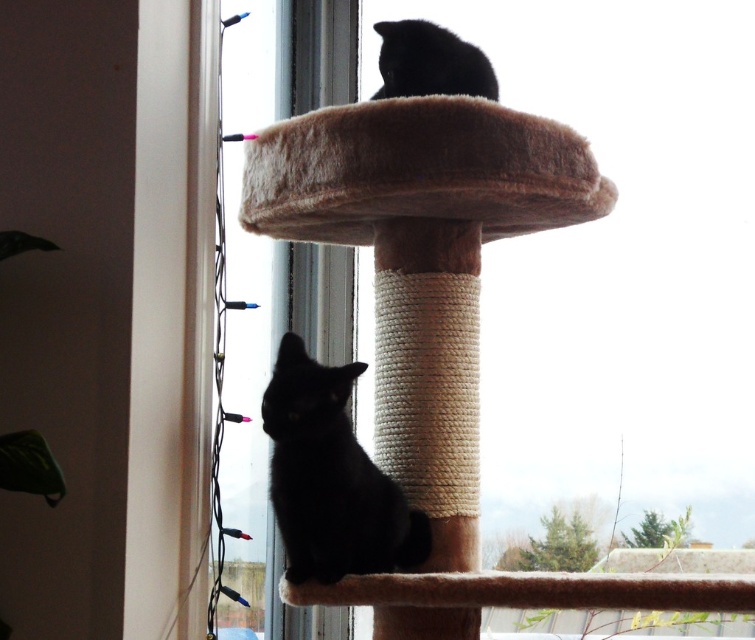
Question: Is black matte cat at lower center above black fur cat at upper center?

Choices:
 (A) no
 (B) yes

Answer: (A)

Question: Is black matte cat at lower center further to camera compared to black fur cat at upper center?

Choices:
 (A) no
 (B) yes

Answer: (A)

Question: Among these objects, which one is nearest to the camera?

Choices:
 (A) brown fuzzy cat bed at upper center
 (B) black matte cat at lower center
 (C) black fur cat at upper center

Answer: (B)

Question: Among these objects, which one is nearest to the camera?

Choices:
 (A) brown fuzzy cat bed at upper center
 (B) black fur cat at upper center
 (C) black matte cat at lower center

Answer: (C)

Question: Which of the following is the closest to the observer?

Choices:
 (A) (325, 490)
 (B) (396, 54)

Answer: (A)

Question: Does black matte cat at lower center come behind black fur cat at upper center?

Choices:
 (A) no
 (B) yes

Answer: (A)